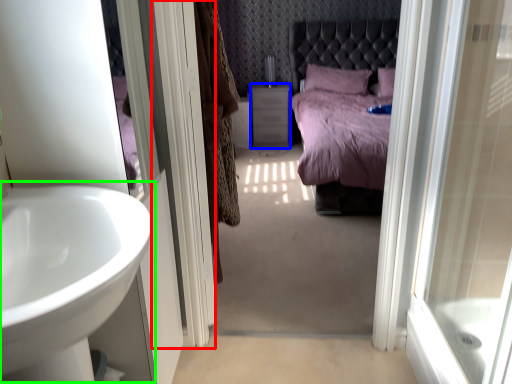
Question: Which object is positioned farthest from screen door (highlighted by a red box)? Select from vanity (highlighted by a blue box) and sink (highlighted by a green box).

Choices:
 (A) vanity
 (B) sink

Answer: (A)